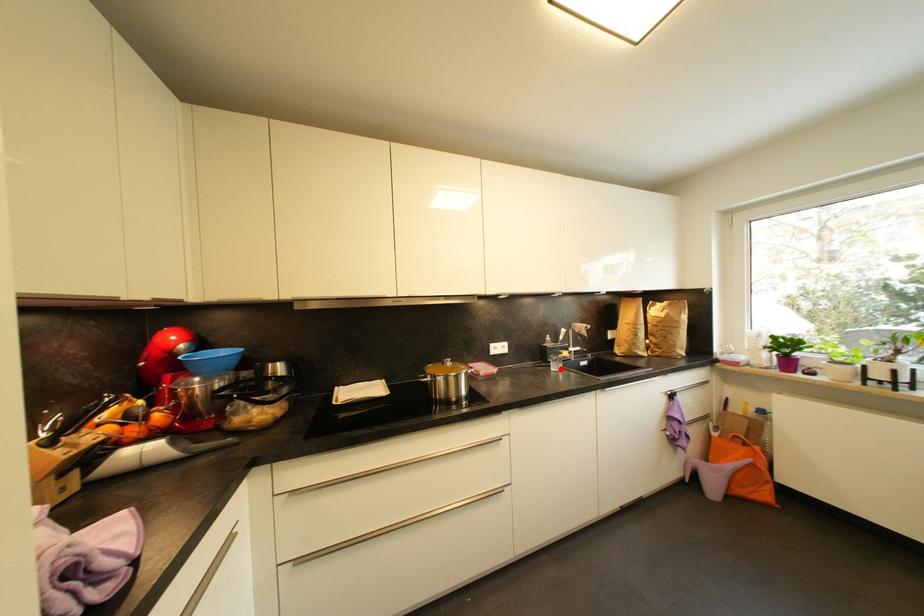
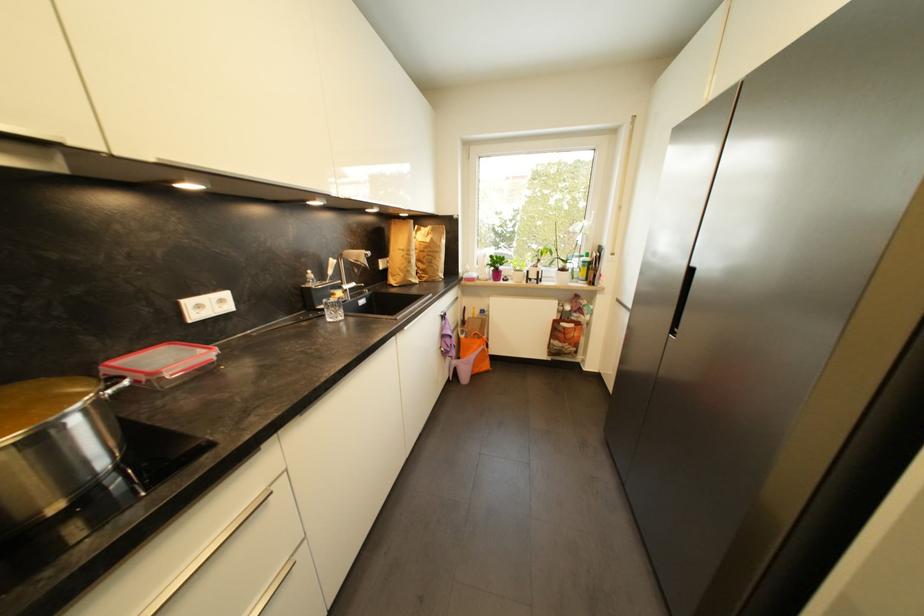
Question: I am providing you with two images of the same scene from different viewpoints. Given a red point in image1, look at the same physical point in image2. Is it:

Choices:
 (A) Closer to the viewpoint
 (B) Farther from the viewpoint

Answer: (A)